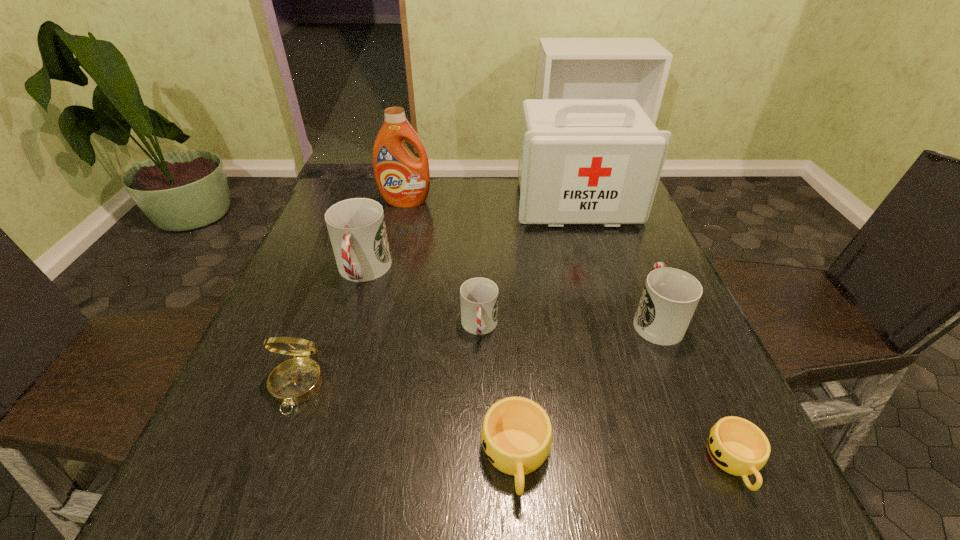
Where is `the first-aid kit`? This screenshot has width=960, height=540. the first-aid kit is located at coordinates (581, 161).

You are a GUI agent. You are given a task and a screenshot of the screen. Output one action in this format:
    pyautogui.click(x=<x>, y=<y>)
    Task: Click on the detergent
    This screenshot has width=960, height=540.
    Given the screenshot: What is the action you would take?
    pyautogui.click(x=403, y=180)

Where is `the biggest red cup`? the biggest red cup is located at coordinates (356, 227).

Find the location of a particular element. the leftmost cup is located at coordinates (356, 227).

Find the location of a particular element. the second tallest cup is located at coordinates (670, 296).

At what (x,y) coordinates should I click in order to perform the action: click on the rightmost red cup. Please return your answer as a coordinate pair (x, y). The height and width of the screenshot is (540, 960). Looking at the image, I should click on (670, 296).

The width and height of the screenshot is (960, 540). Identify the location of the third nearest object. (295, 381).

The image size is (960, 540). I want to click on the third tallest cup, so click(x=478, y=296).

At what (x,y) coordinates should I click in order to perform the action: click on the smallest red cup. Please return your answer as a coordinate pair (x, y). This screenshot has width=960, height=540. Looking at the image, I should click on (478, 296).

Locate an element on the screen. This screenshot has width=960, height=540. the seventh tallest object is located at coordinates (516, 435).